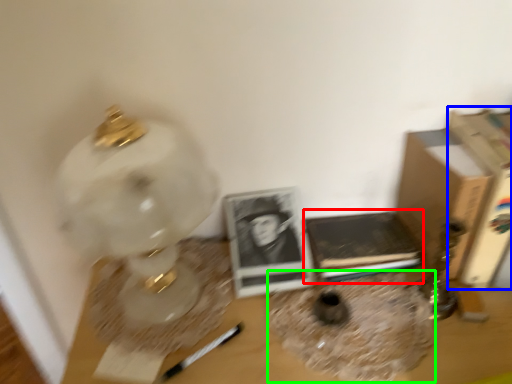
Question: Which is farther away from paperback book (highlighted by a red box)? paperback book (highlighted by a blue box) or vase (highlighted by a green box)?

Choices:
 (A) paperback book
 (B) vase

Answer: (A)